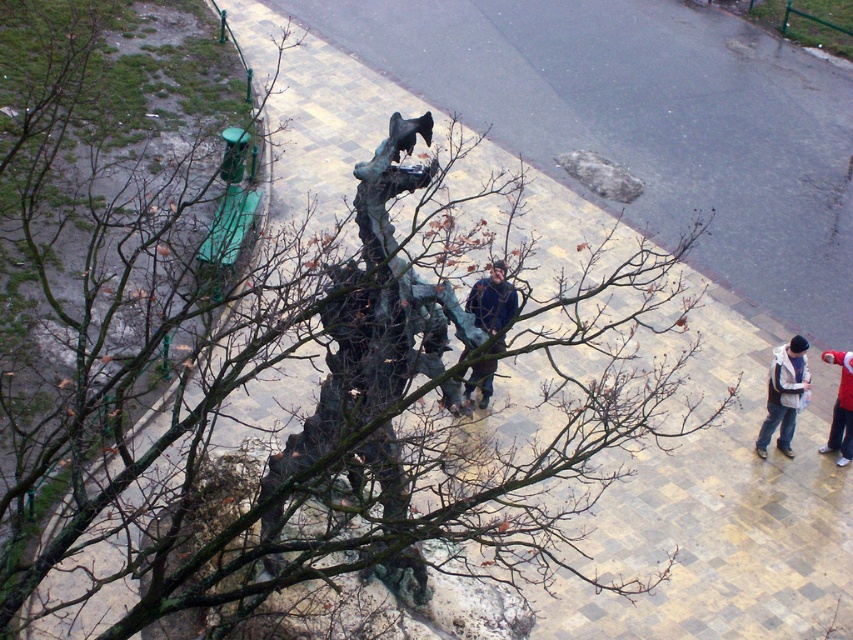
You are standing at the base of the tower and want to take a photo of the bronze statue at center without the dark blue jacket at center blocking the view. Which direction should you move to ensure the statue is visible?

You should move to the right so that the bronze statue at center is no longer blocked by the dark blue jacket at center, as the statue is positioned to the left of the jacket.

You are an observer standing at the base of the tower looking up at the scene. You notice both the gray woolen hat at lower right and the dark blue jacket at center. Which object appears bigger to you?

The gray woolen hat at lower right appears larger than the dark blue jacket at center because it is closer to the observer.